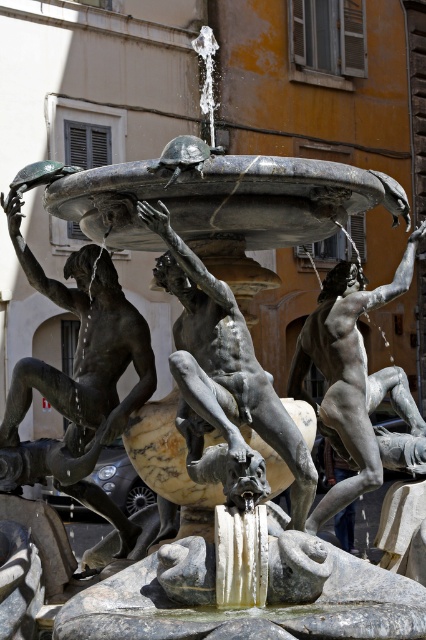
Question: Which object is farther from the camera taking this photo?

Choices:
 (A) polished silver statue at center
 (B) bronze statue at center
 (C) bronze muscular figure at center

Answer: (B)

Question: Is bronze statue at center to the left of bronze muscular figure at center from the viewer's perspective?

Choices:
 (A) no
 (B) yes

Answer: (B)

Question: Is bronze statue at center bigger than bronze muscular figure at center?

Choices:
 (A) yes
 (B) no

Answer: (A)

Question: Which of the following is the closest to the observer?

Choices:
 (A) polished silver statue at center
 (B) bronze muscular figure at center
 (C) bronze statue at center

Answer: (B)

Question: Estimate the real-world distances between objects in this image. Which object is closer to the bronze muscular figure at center?

Choices:
 (A) bronze statue at center
 (B) polished silver statue at center

Answer: (A)

Question: Where is bronze muscular figure at center located in relation to polished silver statue at center in the image?

Choices:
 (A) below
 (B) above

Answer: (B)